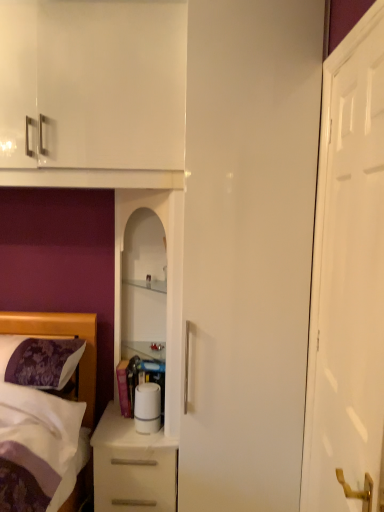
Where is `white glossy door at right`? The height and width of the screenshot is (512, 384). white glossy door at right is located at coordinates (348, 277).

At what (x,y) coordinates should I click in order to perform the action: click on white glossy cabinet at center. Please return your answer as a coordinate pair (x, y). Looking at the image, I should click on (168, 277).

Find the location of a particular element. purple floral fabric pillow at lower left is located at coordinates tap(39, 361).

From a real-world perspective, which object stands above the other?

white glossy door at right.

Considering the relative positions of white glossy door at right and white matte chest of drawers at lower left in the image provided, is white glossy door at right to the left of white matte chest of drawers at lower left from the viewer's perspective?

No, white glossy door at right is not to the left of white matte chest of drawers at lower left.

Can you confirm if white glossy door at right is thinner than white matte chest of drawers at lower left?

Indeed, white glossy door at right has a lesser width compared to white matte chest of drawers at lower left.

Can you tell me how much white glossy cabinet at center and white matte chest of drawers at lower left differ in facing direction?

They differ by 1.45 degrees in their facing directions.

Does white glossy cabinet at center have a greater width compared to white matte chest of drawers at lower left?

Incorrect, the width of white glossy cabinet at center does not surpass that of white matte chest of drawers at lower left.

From the image's perspective, between white glossy cabinet at center and white matte chest of drawers at lower left, who is located below?

From the image's view, white matte chest of drawers at lower left is below.

Does white glossy cabinet at center have a greater height compared to white matte chest of drawers at lower left?

Correct, white glossy cabinet at center is much taller as white matte chest of drawers at lower left.

Considering the relative sizes of white matte chest of drawers at lower left and white glossy cabinet at center in the image provided, is white matte chest of drawers at lower left bigger than white glossy cabinet at center?

Actually, white matte chest of drawers at lower left might be smaller than white glossy cabinet at center.

Is there a large distance between white matte chest of drawers at lower left and white glossy cabinet at center?

No, white matte chest of drawers at lower left is not far away from white glossy cabinet at center.

Could you tell me if white matte chest of drawers at lower left is facing white glossy cabinet at center?

No, white matte chest of drawers at lower left is not turned towards white glossy cabinet at center.

From a real-world perspective, is white matte chest of drawers at lower left below white glossy cabinet at center?

Yes, from a real-world perspective, white matte chest of drawers at lower left is beneath white glossy cabinet at center.

Considering the relative sizes of white glossy door at right and white glossy cabinet at center in the image provided, is white glossy door at right shorter than white glossy cabinet at center?

Incorrect, the height of white glossy door at right does not fall short of that of white glossy cabinet at center.

From the picture: Is white glossy door at right turned away from white glossy cabinet at center?

white glossy door at right is not turned away from white glossy cabinet at center.

Between white glossy door at right and white glossy cabinet at center, which one appears on the left side from the viewer's perspective?

white glossy cabinet at center.

In terms of width, does white glossy door at right look wider or thinner when compared to white glossy cabinet at center?

Considering their sizes, white glossy door at right looks slimmer than white glossy cabinet at center.

From the image's perspective, which one is positioned higher, white matte chest of drawers at lower left or white glossy door at right?

white glossy door at right.

Find the location of `door located on the right of white matte chest of drawers at lower left`. door located on the right of white matte chest of drawers at lower left is located at coordinates pos(348,277).

Between white matte chest of drawers at lower left and white glossy door at right, which one has larger width?

white matte chest of drawers at lower left is wider.

Between purple floral fabric pillow at lower left and white matte chest of drawers at lower left, which one has larger width?

white matte chest of drawers at lower left is wider.

Which is in front, point (61, 381) or point (116, 459)?

Positioned in front is point (61, 381).

How different are the orientations of purple floral fabric pillow at lower left and white matte chest of drawers at lower left in degrees?

They differ by 1.75 degrees in their facing directions.

How many degrees apart are the facing directions of white matte chest of drawers at lower left and purple floral fabric pillow at lower left?

white matte chest of drawers at lower left and purple floral fabric pillow at lower left are facing 1.75 degrees away from each other.

Is white matte chest of drawers at lower left placed right next to purple floral fabric pillow at lower left?

No, white matte chest of drawers at lower left is not next to purple floral fabric pillow at lower left.

Who is taller, white matte chest of drawers at lower left or purple floral fabric pillow at lower left?

With more height is white matte chest of drawers at lower left.

Looking at the image, does white matte chest of drawers at lower left seem bigger or smaller compared to purple floral fabric pillow at lower left?

Considering their sizes, white matte chest of drawers at lower left takes up more space than purple floral fabric pillow at lower left.

Where is `chest of drawers located on the left of white glossy door at right`? This screenshot has height=512, width=384. chest of drawers located on the left of white glossy door at right is located at coordinates (132, 466).

Identify the location of cabinetry above the white matte chest of drawers at lower left (from the image's perspective). (168, 277).

Considering their positions, is white matte chest of drawers at lower left positioned closer to purple floral fabric pillow at lower left than white glossy cabinet at center?

white matte chest of drawers at lower left is positioned closer to the anchor purple floral fabric pillow at lower left.

From the picture: Which object lies nearer to the anchor point white glossy door at right, purple floral fabric pillow at lower left or white matte chest of drawers at lower left?

white matte chest of drawers at lower left lies closer to white glossy door at right than the other object.

When comparing their distances from purple floral fabric pillow at lower left, does white glossy door at right or white matte chest of drawers at lower left seem further?

white glossy door at right is positioned further to the anchor purple floral fabric pillow at lower left.

Considering their positions, is purple floral fabric pillow at lower left positioned closer to white matte chest of drawers at lower left than white glossy cabinet at center?

white glossy cabinet at center.

From the image, which object appears to be nearer to white matte chest of drawers at lower left, purple floral fabric pillow at lower left or white glossy door at right?

purple floral fabric pillow at lower left is closer to white matte chest of drawers at lower left.

When comparing their distances from white matte chest of drawers at lower left, does white glossy door at right or white glossy cabinet at center seem closer?

white glossy cabinet at center lies closer to white matte chest of drawers at lower left than the other object.

Based on their spatial positions, is white glossy cabinet at center or purple floral fabric pillow at lower left closer to white matte chest of drawers at lower left?

white glossy cabinet at center is closer to white matte chest of drawers at lower left.

Which object lies nearer to the anchor point white glossy door at right, purple floral fabric pillow at lower left or white glossy cabinet at center?

white glossy cabinet at center is positioned closer to the anchor white glossy door at right.

Identify the location of chest of drawers between purple floral fabric pillow at lower left and white glossy door at right from left to right. The image size is (384, 512). (132, 466).

You are a GUI agent. You are given a task and a screenshot of the screen. Output one action in this format:
    pyautogui.click(x=<x>, y=<y>)
    Task: Click on the pillow between white glossy cabinet at center and white matte chest of drawers at lower left vertically
    
    Given the screenshot: What is the action you would take?
    pyautogui.click(x=39, y=361)

You are a GUI agent. You are given a task and a screenshot of the screen. Output one action in this format:
    pyautogui.click(x=<x>, y=<y>)
    Task: Click on the cabinetry located between white glossy door at right and white matte chest of drawers at lower left in the depth direction
    The width and height of the screenshot is (384, 512).
    Given the screenshot: What is the action you would take?
    pyautogui.click(x=168, y=277)

Locate an element on the screen. This screenshot has width=384, height=512. cabinetry situated between purple floral fabric pillow at lower left and white glossy door at right from left to right is located at coordinates (168, 277).